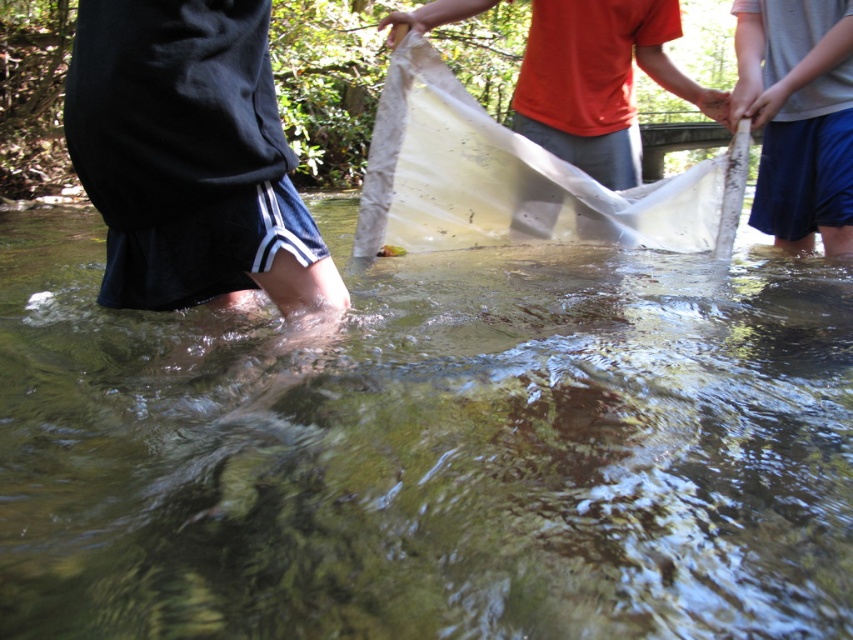
You are a safety inspector checking the equipment used in water activities. You notice the transparent plastic net at center and the smooth skin hand at upper center. Which one is bigger in size?

The transparent plastic net at center has a larger size compared to the smooth skin hand at upper center.

You are trying to determine the relative sizes of objects in the scene. Which is taller between the gray fabric net at lower right and the smooth skin hand at upper center?

The gray fabric net at lower right is much taller than the smooth skin hand at upper center.